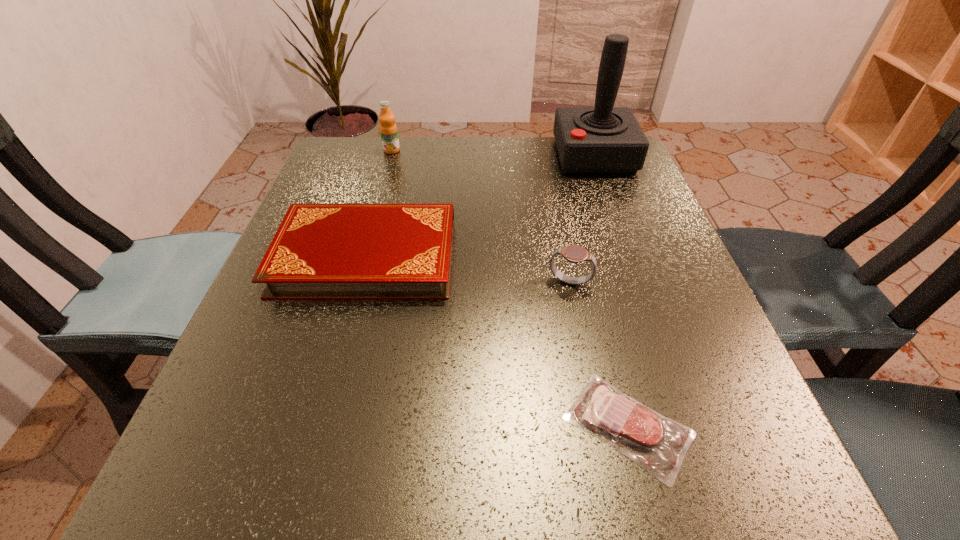
Where is `vacant region located 0.210m on the left of the watch`? The width and height of the screenshot is (960, 540). vacant region located 0.210m on the left of the watch is located at coordinates (427, 283).

Image resolution: width=960 pixels, height=540 pixels. Find the location of `vacant space located 0.280m on the cover of the hardback book`. vacant space located 0.280m on the cover of the hardback book is located at coordinates (602, 256).

At what (x,y) coordinates should I click in order to perform the action: click on vacant space located 0.220m on the back of the nearest object. Please return your answer as a coordinate pair (x, y). Looking at the image, I should click on (589, 270).

You are a GUI agent. You are given a task and a screenshot of the screen. Output one action in this format:
    pyautogui.click(x=<x>, y=<y>)
    Task: Click on the joystick present at the far edge
    This screenshot has width=960, height=540.
    Given the screenshot: What is the action you would take?
    click(x=602, y=139)

Identify the location of orange juice that is at the far edge. [x=388, y=129].

Where is `object that is at the near edge`? This screenshot has width=960, height=540. object that is at the near edge is located at coordinates (658, 444).

Where is `orange juice at the left edge`? The height and width of the screenshot is (540, 960). orange juice at the left edge is located at coordinates [388, 129].

The width and height of the screenshot is (960, 540). Find the location of `hardback book that is at the left edge`. hardback book that is at the left edge is located at coordinates (320, 251).

Where is `joystick located in the right edge section of the desktop`? The width and height of the screenshot is (960, 540). joystick located in the right edge section of the desktop is located at coordinates (602, 139).

Where is `steak that is at the right edge`? This screenshot has width=960, height=540. steak that is at the right edge is located at coordinates (658, 444).